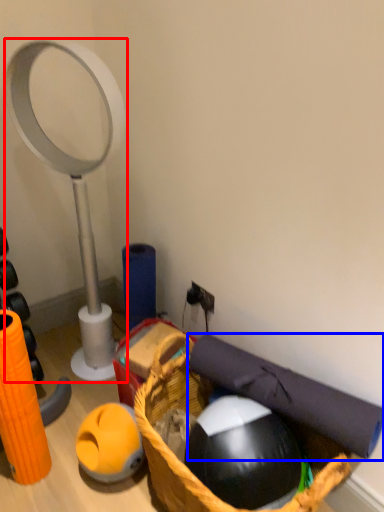
Question: Which object is further to the camera taking this photo, magnifying glass (highlighted by a red box) or yoga mat (highlighted by a blue box)?

Choices:
 (A) magnifying glass
 (B) yoga mat

Answer: (A)